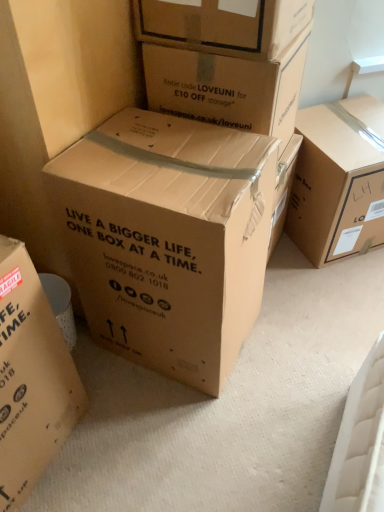
Question: Considering the positions of point (44, 78) and point (76, 240), is point (44, 78) closer or farther from the camera than point (76, 240)?

Choices:
 (A) closer
 (B) farther

Answer: (A)

Question: Which is correct: brown cardboard box at center, which ranks as the second box in left-to-right order, is inside brown cardboard box at center, the fourth box viewed from the right, or outside of it?

Choices:
 (A) inside
 (B) outside

Answer: (B)

Question: Based on their relative distances, which object is nearer to the brown cardboard box at upper right, acting as the first box starting from the right?

Choices:
 (A) brown cardboard box at upper center, the second box in the right-to-left sequence
 (B) brown cardboard box at center, the 3th box viewed from the left
 (C) brown cardboard box at upper center, which ranks as the fourth box in left-to-right order
 (D) brown cardboard box at center, which is the first box in left-to-right order
 (E) brown cardboard box at center, placed as the fifth box when sorted from right to left

Answer: (A)

Question: Based on their relative distances, which object is nearer to the brown cardboard box at center, which ranks as the second box in left-to-right order?

Choices:
 (A) brown cardboard box at center, which is the first box in left-to-right order
 (B) brown cardboard box at upper center, the second box in the right-to-left sequence
 (C) brown cardboard box at upper center, which ranks as the fourth box in left-to-right order
 (D) brown cardboard box at center, the 3th box viewed from the left
 (E) brown cardboard box at upper right, acting as the first box starting from the right

Answer: (C)